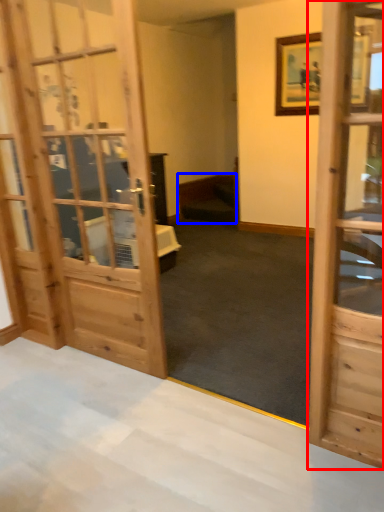
Question: Among these objects, which one is nearest to the camera, door (highlighted by a red box) or furniture (highlighted by a blue box)?

Choices:
 (A) door
 (B) furniture

Answer: (A)